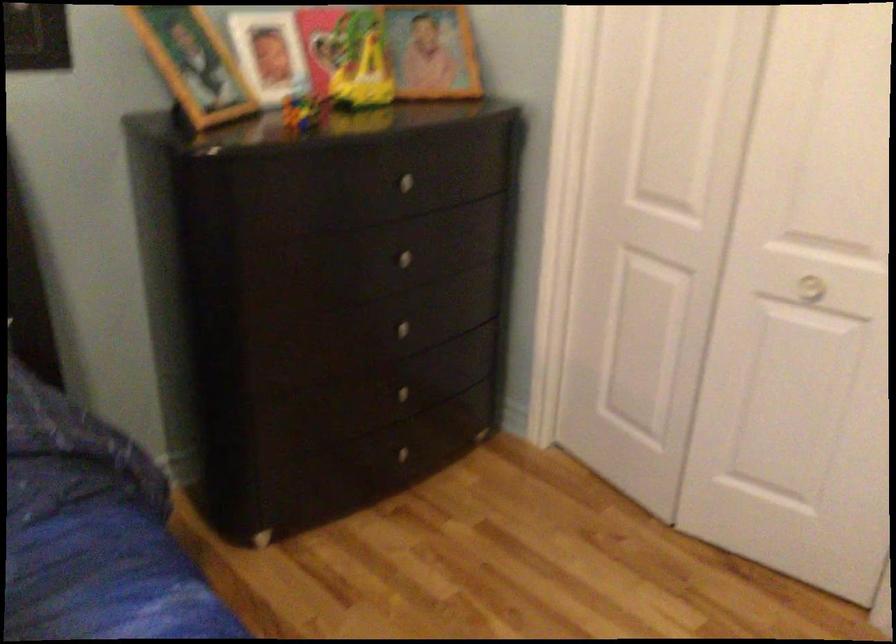
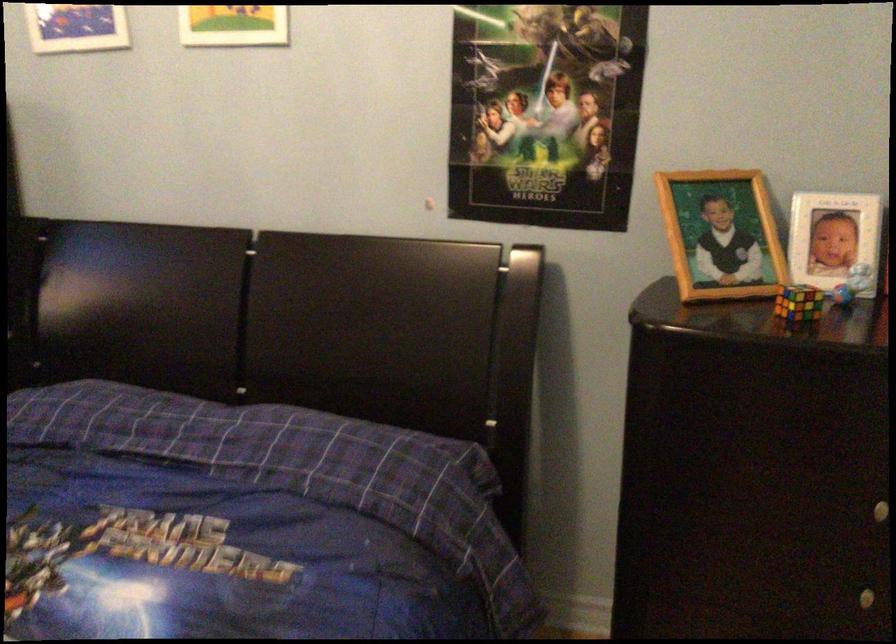
Locate, in the second image, the point that corresponds to [408,327] in the first image.

(868, 597)